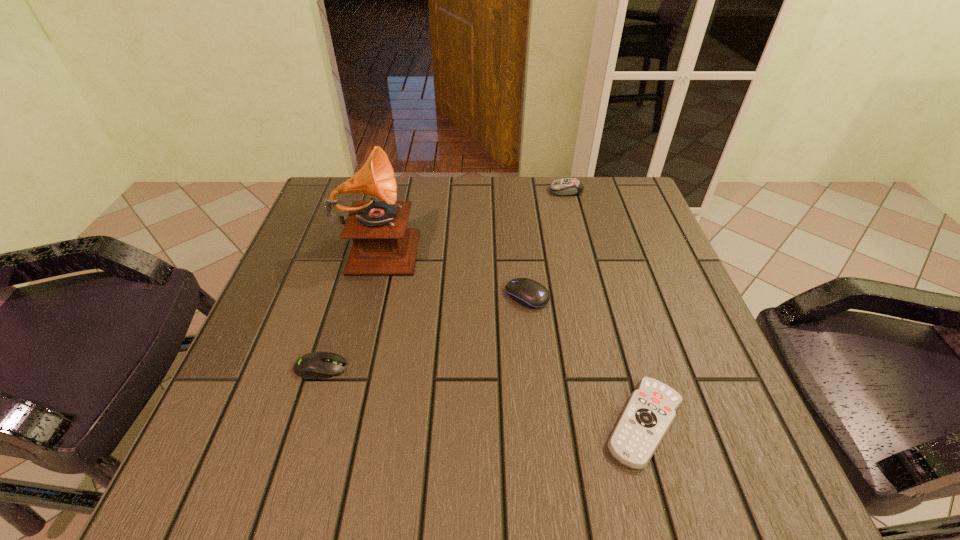
The height and width of the screenshot is (540, 960). Identify the location of the fourth nearest object. (382, 245).

This screenshot has height=540, width=960. In order to click on the tallest object in this screenshot , I will do `click(382, 245)`.

This screenshot has width=960, height=540. I want to click on the farthest object, so click(567, 186).

Find the location of a particular element. This screenshot has height=540, width=960. the rightmost computer mouse is located at coordinates (567, 186).

Find the location of a particular element. The width and height of the screenshot is (960, 540). the second computer mouse from left to right is located at coordinates (531, 294).

The width and height of the screenshot is (960, 540). I want to click on the third object from left to right, so click(x=531, y=294).

This screenshot has width=960, height=540. In order to click on the leftmost computer mouse in this screenshot , I will do `click(316, 365)`.

This screenshot has width=960, height=540. What are the coordinates of `the shortest computer mouse` in the screenshot? It's located at (316, 365).

This screenshot has height=540, width=960. Find the location of `remote control`. remote control is located at coordinates (650, 411).

Locate an element on the screen. This screenshot has height=540, width=960. the shortest object is located at coordinates (650, 411).